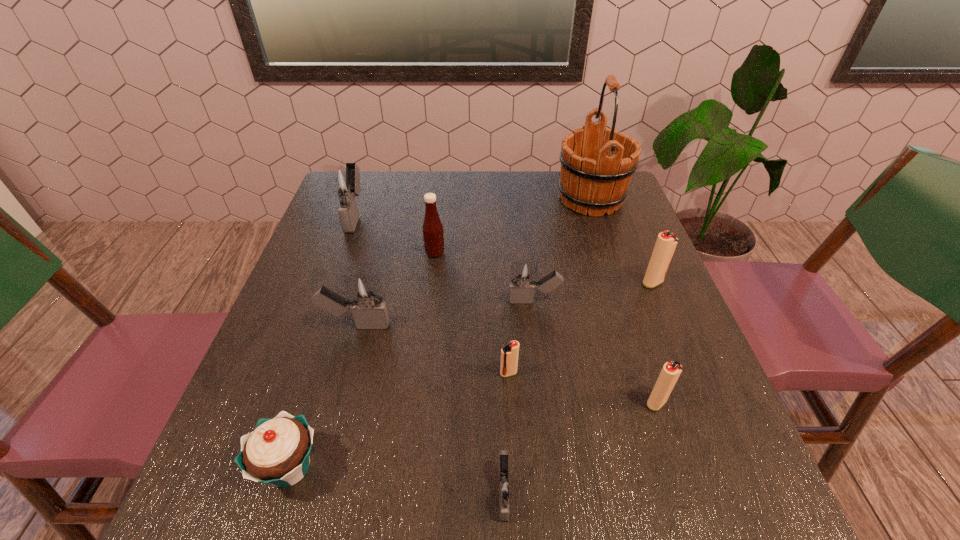
Identify the location of free space that satisfies the following two spatial constraints: 1. on the front side of the tallest igniter; 2. on the left side of the third smallest gray igniter. Image resolution: width=960 pixels, height=540 pixels. (317, 325).

What are the coordinates of `vacant point that satisfies the following two spatial constraints: 1. on the front side of the leftmost red igniter; 2. on the right side of the third farthest object` in the screenshot? It's located at (421, 373).